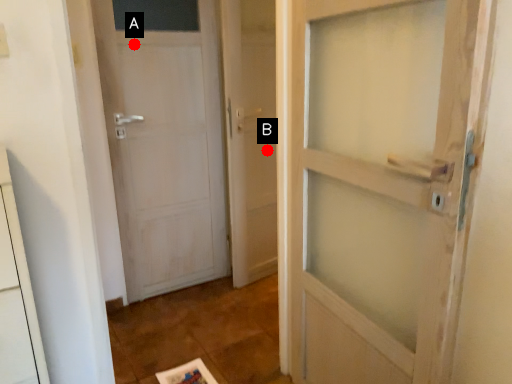
Question: Two points are circled on the image, labeled by A and B beside each circle. Which point is closer to the camera?

Choices:
 (A) A is closer
 (B) B is closer

Answer: (A)